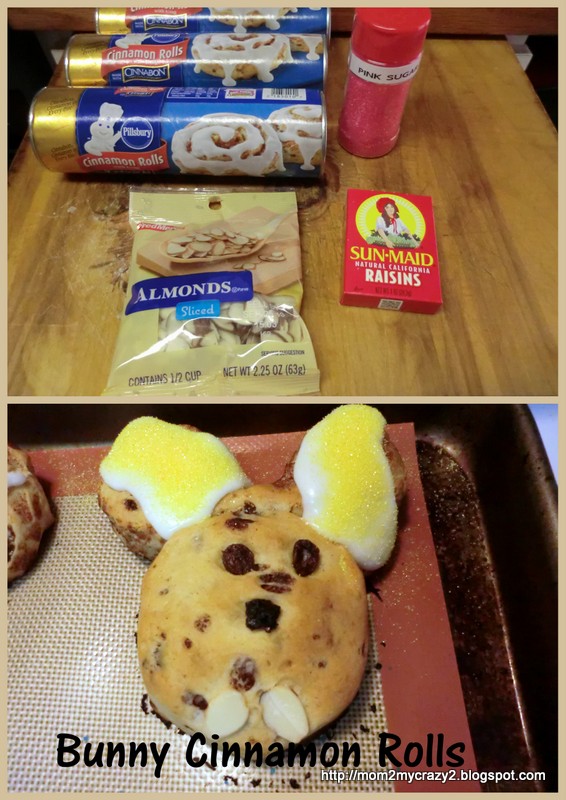
Find the location of a particular element. This screenshot has width=566, height=800. crumbs is located at coordinates (121, 246).